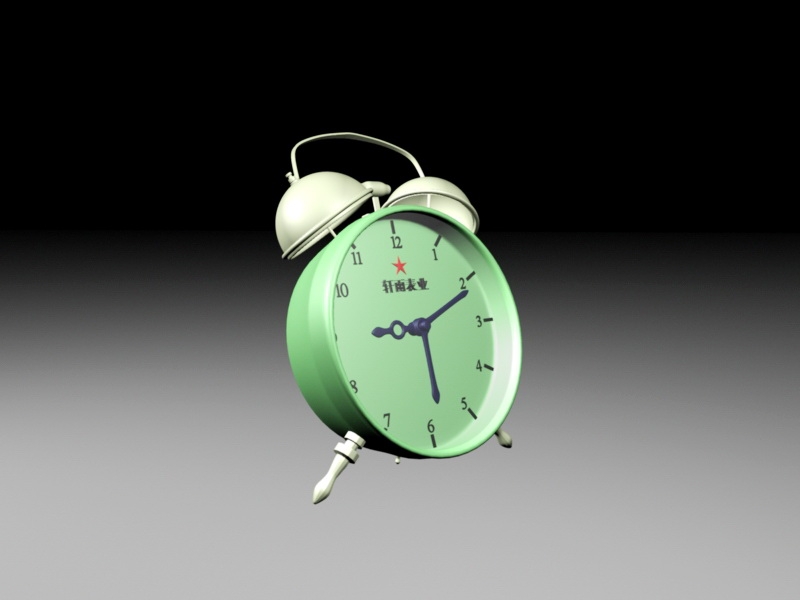
At what (x,y) coordinates should I click in order to perform the action: click on handle. Please return your answer as a coordinate pair (x, y). This screenshot has width=800, height=600. Looking at the image, I should click on (353, 133).